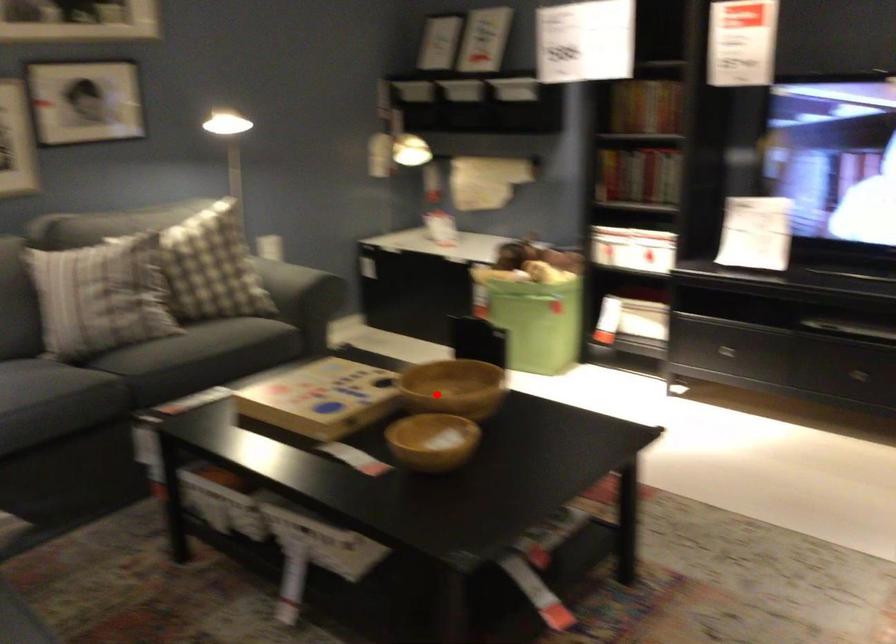
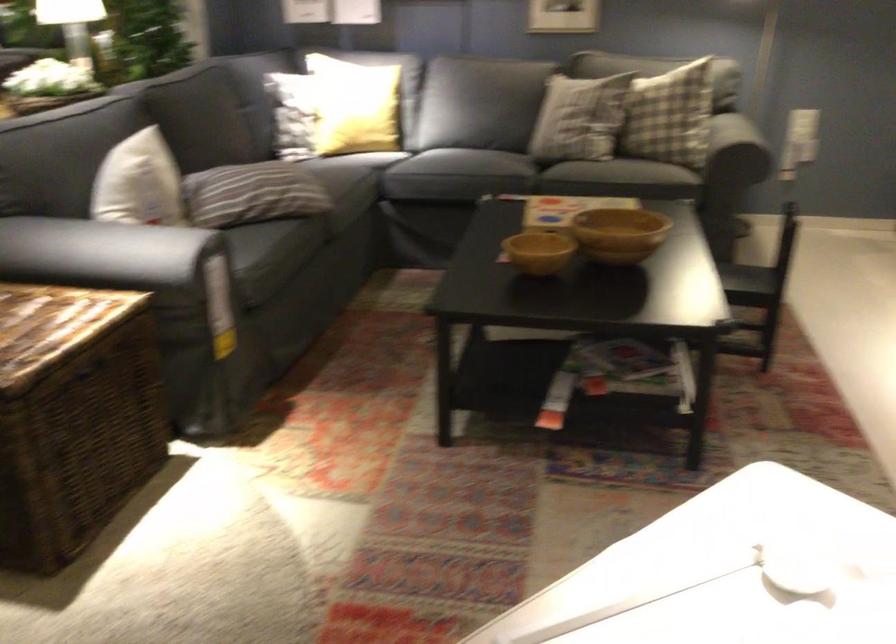
In the second image, find the point that corresponds to the highlighted location in the first image.

(618, 234)